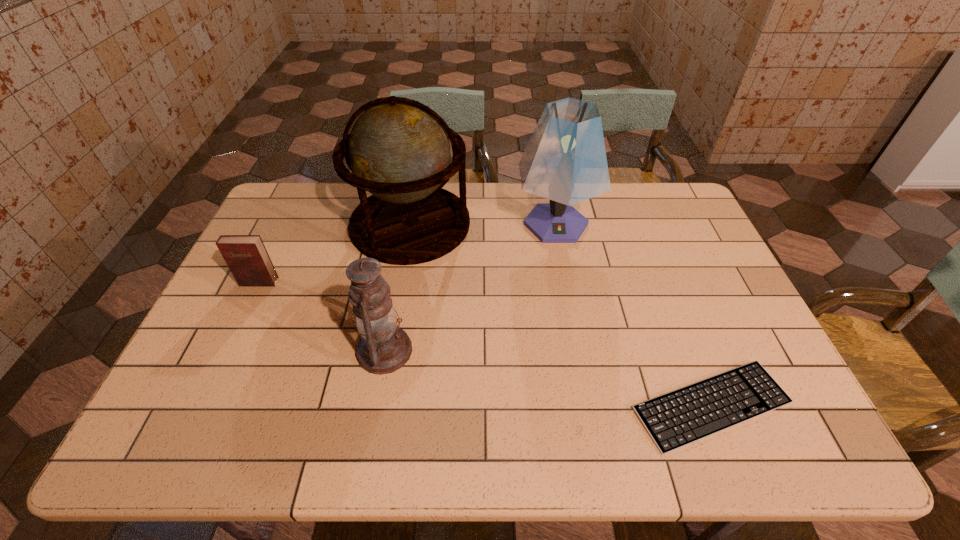
You are a GUI agent. You are given a task and a screenshot of the screen. Output one action in this format:
    pyautogui.click(x=<x>, y=<y>)
    Task: Click on the globe
    Image resolution: width=960 pixels, height=540 pixels.
    Given the screenshot: What is the action you would take?
    pyautogui.click(x=398, y=150)

Locate an element on the screen. The height and width of the screenshot is (540, 960). lampshade is located at coordinates (565, 161).

Where is `oil lamp`? The height and width of the screenshot is (540, 960). oil lamp is located at coordinates (383, 348).

Identify the location of diary. (246, 256).

The height and width of the screenshot is (540, 960). Find the location of `the leftmost object`. the leftmost object is located at coordinates (246, 256).

What are the coordinates of `the shortest object` in the screenshot? It's located at (681, 417).

Locate an element on the screen. The width and height of the screenshot is (960, 540). vacant space positioned 0.130m on the front-facing side of the globe is located at coordinates (508, 224).

I want to click on free space located on the base of the lampshade, so click(x=566, y=283).

This screenshot has height=540, width=960. In order to click on free space located 0.050m on the left of the third tallest object in this screenshot , I will do `click(337, 350)`.

This screenshot has width=960, height=540. What are the coordinates of `free location located 0.310m on the front cover of the leftmost object` in the screenshot? It's located at (212, 379).